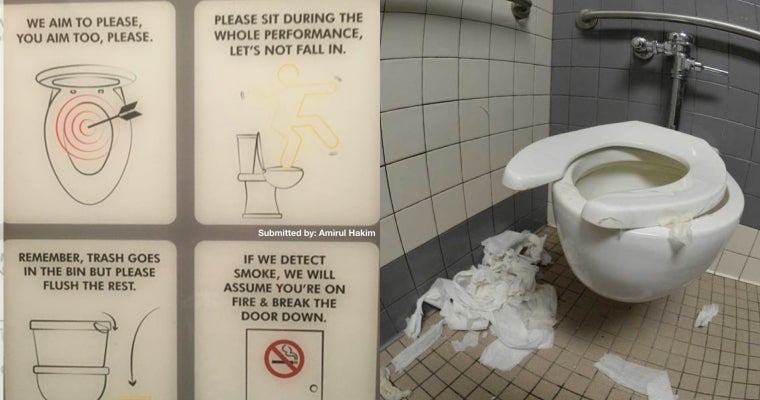
At what (x,y) coordinates should I click in order to perform the action: click on floor. Please return your answer as a coordinate pair (x, y). Looking at the image, I should click on (663, 321).